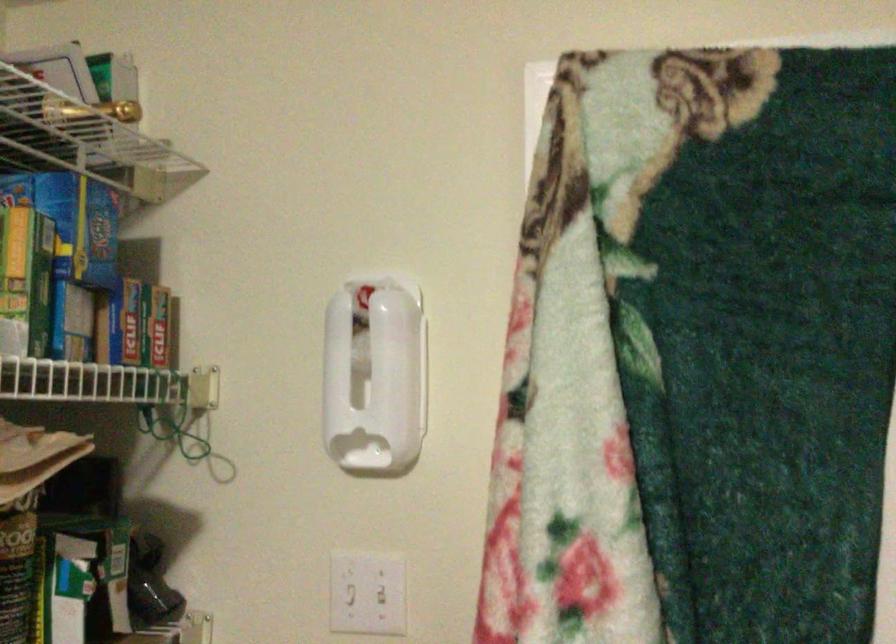
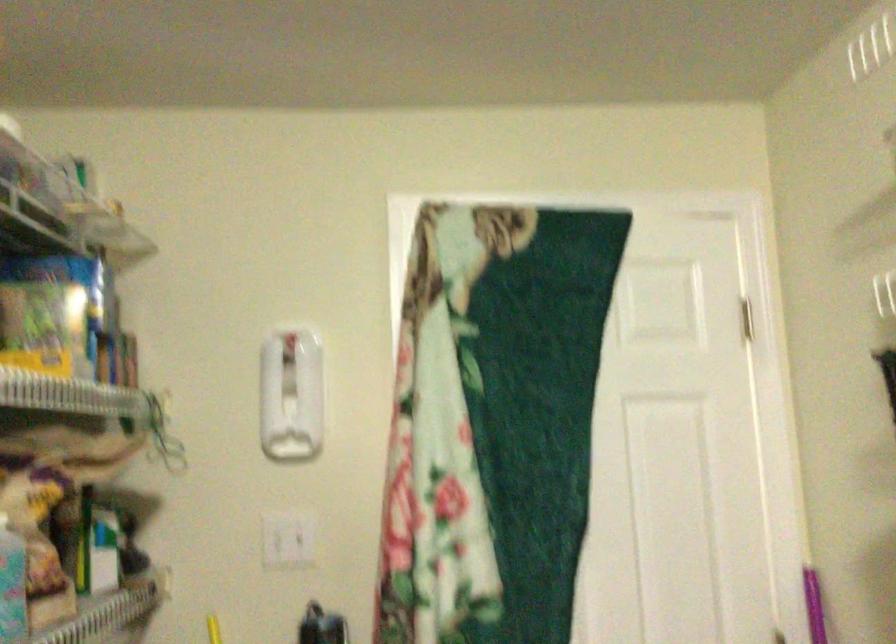
Question: Based on the continuous images, in which direction is the camera rotating? Reply with the corresponding letter.

Choices:
 (A) Left
 (B) Right
 (C) Up
 (D) Down

Answer: (B)